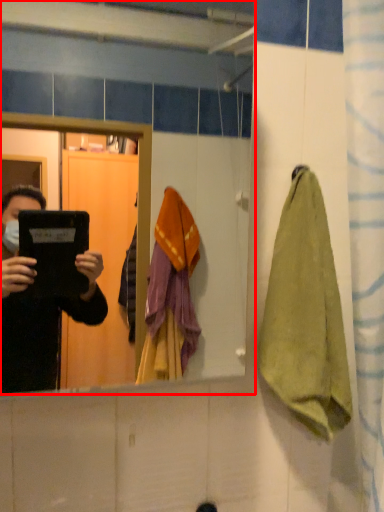
Question: From the image's perspective, what is the correct spatial relationship of mirror (annotated by the red box) in relation to towel/napkin?

Choices:
 (A) below
 (B) above

Answer: (B)